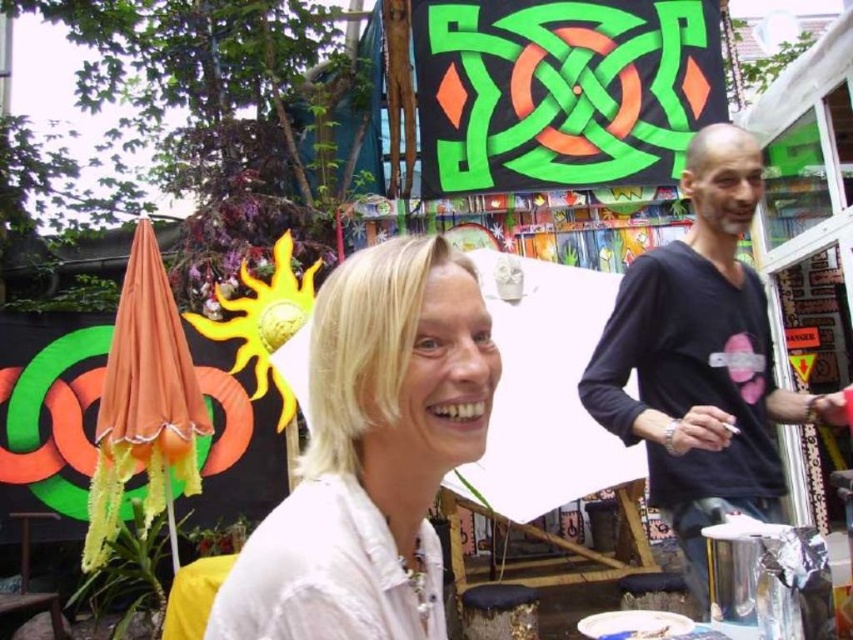
Question: Can you confirm if white matte shirt at center is positioned above black matte shirt at right?

Choices:
 (A) yes
 (B) no

Answer: (B)

Question: Which point is farther from the camera taking this photo?

Choices:
 (A) (418, 278)
 (B) (704, 394)

Answer: (B)

Question: Does white matte shirt at center come in front of black matte shirt at right?

Choices:
 (A) no
 (B) yes

Answer: (B)

Question: Which object is closer to the camera taking this photo?

Choices:
 (A) black matte shirt at right
 (B) white matte shirt at center

Answer: (B)

Question: Can you confirm if white matte shirt at center is positioned below black matte shirt at right?

Choices:
 (A) no
 (B) yes

Answer: (B)